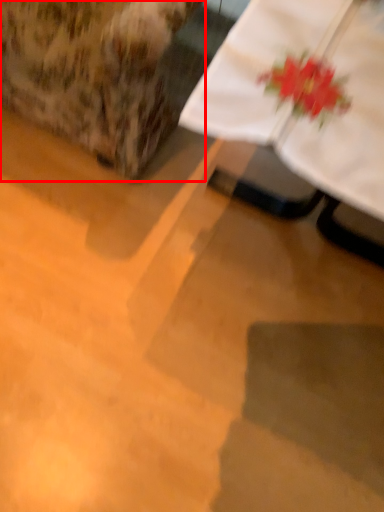
Question: From the image, what is the correct spatial relationship of armchair (annotated by the red box) in relation to table?

Choices:
 (A) left
 (B) right

Answer: (A)